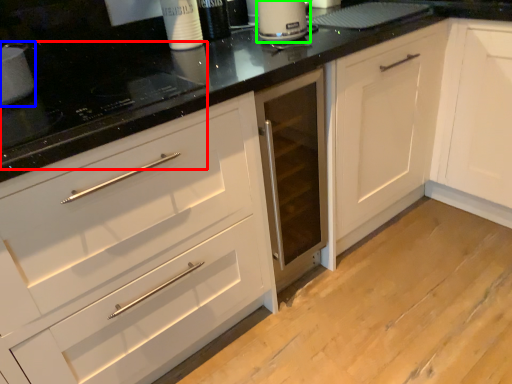
Question: Based on their relative distances, which object is nearer to appliance (highlighted by a red box)? Choose from appliance (highlighted by a blue box) and kitchen appliance (highlighted by a green box).

Choices:
 (A) appliance
 (B) kitchen appliance

Answer: (A)